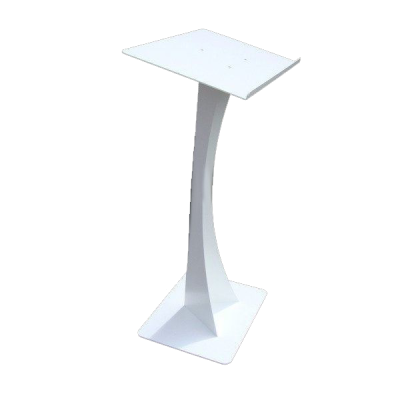
At what (x,y) coordinates should I click in order to perform the action: click on rear of podium. Please return your answer as a coordinate pair (x, y). The width and height of the screenshot is (400, 400). Looking at the image, I should click on (298, 343).